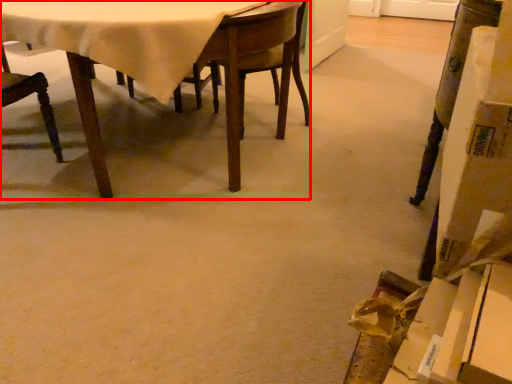
Question: From the image's perspective, where is table (annotated by the red box) located relative to chair?

Choices:
 (A) below
 (B) above

Answer: (B)